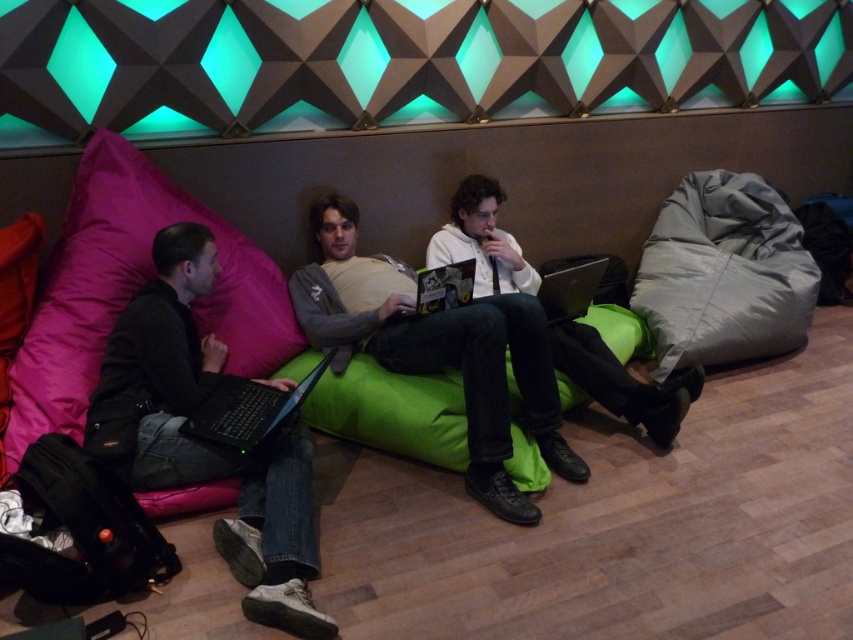
Is light brown leather jacket at center smaller than black matte laptop at left?

No.

Can you confirm if light brown leather jacket at center is positioned above black matte laptop at left?

Yes.

Locate an element on the screen. The width and height of the screenshot is (853, 640). light brown leather jacket at center is located at coordinates (439, 352).

Can you confirm if black matte laptop at left is smaller than matte black laptop at center?

Incorrect, black matte laptop at left is not smaller in size than matte black laptop at center.

You are a GUI agent. You are given a task and a screenshot of the screen. Output one action in this format:
    pyautogui.click(x=<x>, y=<y>)
    Task: Click on the black matte laptop at left
    
    Given the screenshot: What is the action you would take?
    pyautogui.click(x=248, y=410)

The image size is (853, 640). What do you see at coordinates (248, 410) in the screenshot? I see `black matte laptop at left` at bounding box center [248, 410].

Where is `black matte laptop at left`? This screenshot has width=853, height=640. black matte laptop at left is located at coordinates (248, 410).

Does black matte laptop at left have a greater height compared to black glossy laptop at center?

Yes.

Who is positioned more to the left, black matte laptop at left or black glossy laptop at center?

From the viewer's perspective, black matte laptop at left appears more on the left side.

Is point (262, 420) closer to viewer compared to point (590, 284)?

Yes, it is in front of point (590, 284).

Where is `black matte laptop at left`? black matte laptop at left is located at coordinates (248, 410).